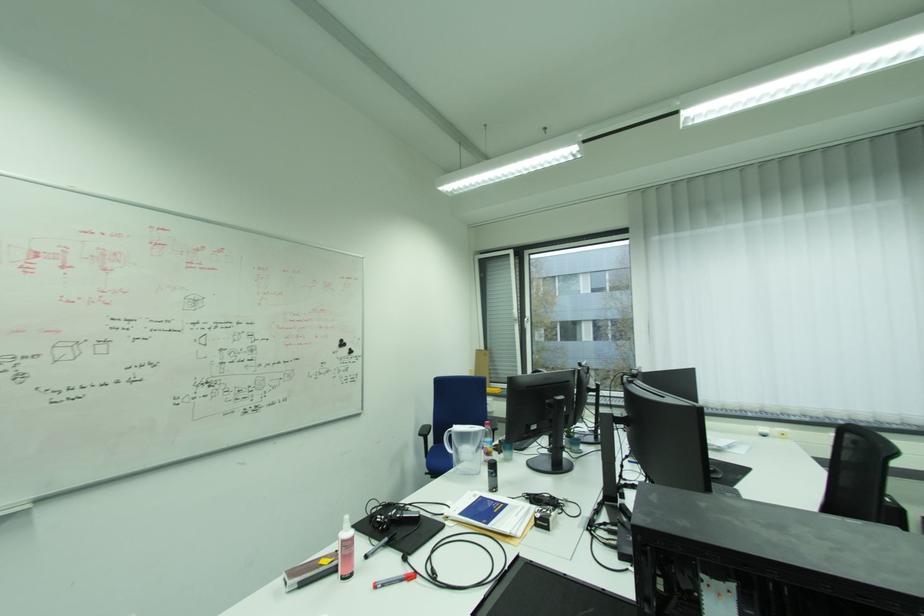
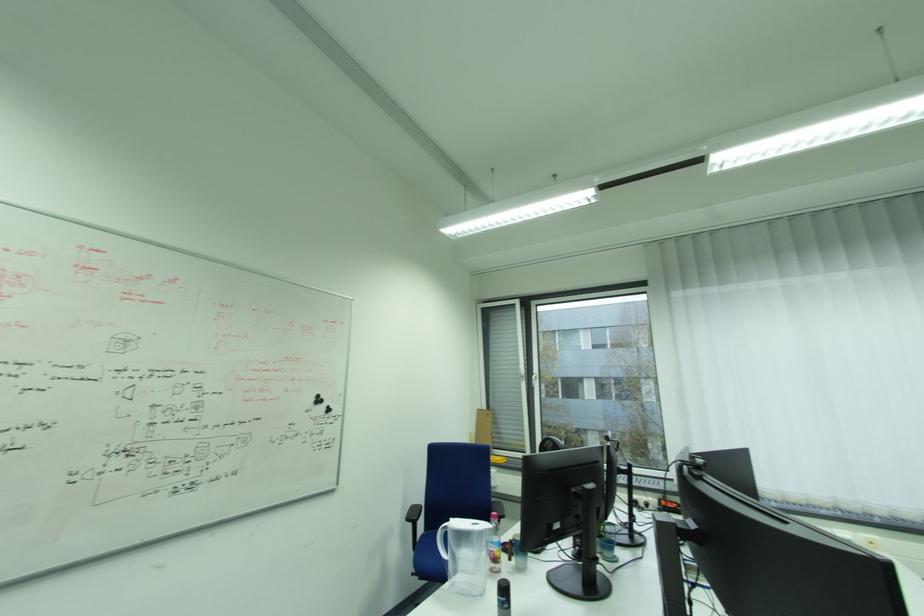
The point at (496,472) is marked in the first image. Where is the corresponding point in the second image?

(505, 600)